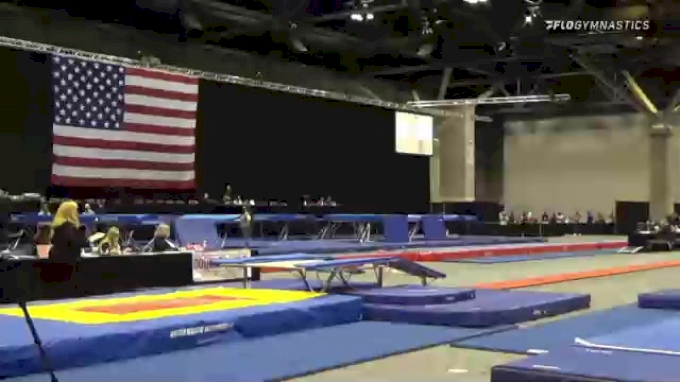
At what (x,y) coordinates should I click in order to perform the action: click on yellow mats. Please return your answer as a coordinate pair (x, y). This screenshot has height=382, width=680. Looking at the image, I should click on (277, 298).